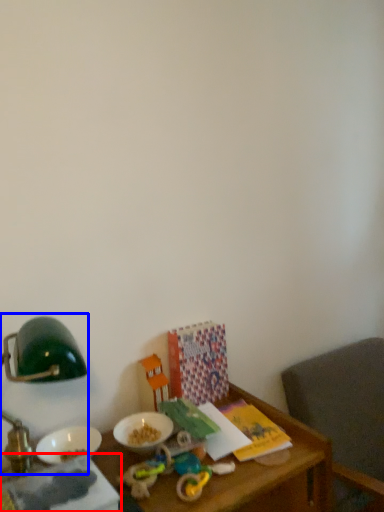
Question: Which object appears farthest to the camera in this image, book (highlighted by a red box) or bedside lamp (highlighted by a blue box)?

Choices:
 (A) book
 (B) bedside lamp

Answer: (B)